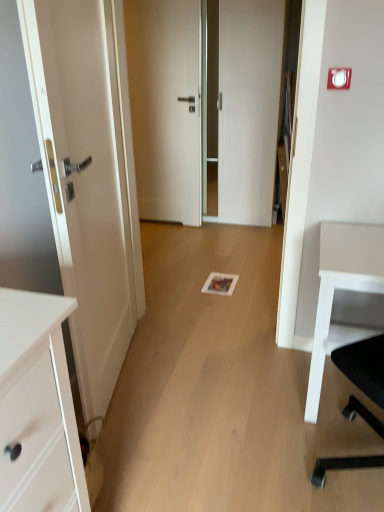
Question: Based on their positions, is white glossy door at center, placed as the 2th door when sorted from front to back, located to the left or right of white glossy door at left, positioned as the 1th door in front-to-back order?

Choices:
 (A) left
 (B) right

Answer: (B)

Question: Is white glossy door at center, marked as the second door in a back-to-front arrangement, in front of or behind white glossy door at left, positioned as the 1th door in front-to-back order, in the image?

Choices:
 (A) front
 (B) behind

Answer: (B)

Question: Estimate the real-world distances between objects in this image. Which object is closer to the white glossy door at center, placed as the 2th door when sorted from front to back?

Choices:
 (A) white glossy door at left, the 3th door from the back
 (B) white matte desk at right
 (C) white matte door at center, the third door when ordered from front to back

Answer: (C)

Question: Estimate the real-world distances between objects in this image. Which object is farther from the white glossy door at center, marked as the second door in a back-to-front arrangement?

Choices:
 (A) white glossy door at left, the 3th door from the back
 (B) white matte desk at right
 (C) white matte door at center, the third door when ordered from front to back

Answer: (B)